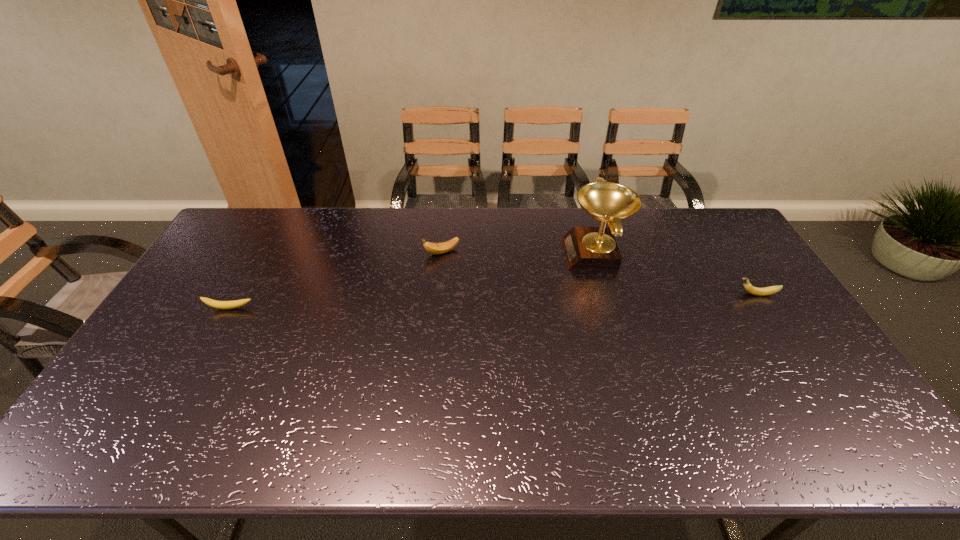
This screenshot has height=540, width=960. I want to click on vacant space situated on the front-facing side of the second object from right to left, so click(541, 254).

This screenshot has height=540, width=960. I want to click on free space located on the back of the third object from right to left, so click(444, 224).

Locate an element on the screen. The height and width of the screenshot is (540, 960). vacant space located at the stem of the rightmost banana is located at coordinates (629, 294).

Where is `vacant space located at the stem of the rightmost banana`? The image size is (960, 540). vacant space located at the stem of the rightmost banana is located at coordinates (706, 294).

Locate an element on the screen. The height and width of the screenshot is (540, 960). blank space located 0.120m at the stem of the rightmost banana is located at coordinates (696, 294).

Image resolution: width=960 pixels, height=540 pixels. What are the coordinates of `vacant space situated 0.340m on the upward curve of the leftmost banana` in the screenshot? It's located at (171, 414).

Where is `award that is at the far edge`? This screenshot has width=960, height=540. award that is at the far edge is located at coordinates (586, 248).

The height and width of the screenshot is (540, 960). What are the coordinates of `banana that is positioned at the far edge` in the screenshot? It's located at (434, 248).

At what (x,y) coordinates should I click in order to perform the action: click on object positioned at the left edge. Please return your answer as a coordinate pair (x, y). Image resolution: width=960 pixels, height=540 pixels. Looking at the image, I should click on (224, 305).

Identify the location of object that is at the right edge. The height and width of the screenshot is (540, 960). (749, 288).